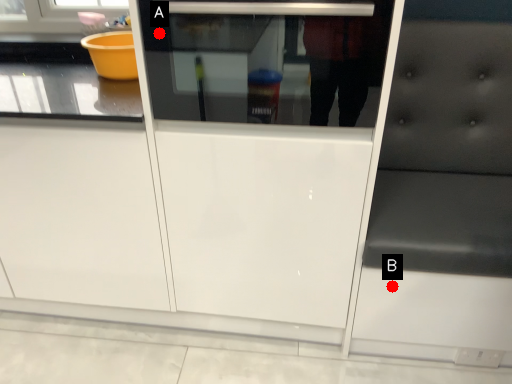
Question: Two points are circled on the image, labeled by A and B beside each circle. Which point is closer to the camera?

Choices:
 (A) A is closer
 (B) B is closer

Answer: (A)